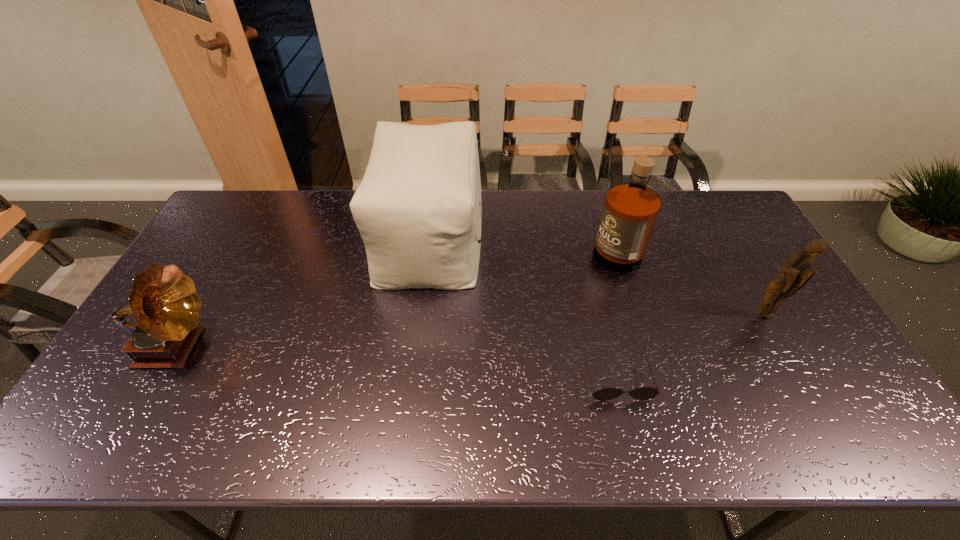
Image resolution: width=960 pixels, height=540 pixels. What are the coordinates of `unoccupied position between the figurine and the leftmost object` in the screenshot? It's located at (469, 331).

In order to click on vacant space in between the sunglasses and the fourth object from right to left in this screenshot , I will do `click(523, 309)`.

Choose which object is the nearest neighbor to the figurine. Please provide its 2D coordinates. Your answer should be formatted as a tuple, i.e. [(x, y)], where the tuple contains the x and y coordinates of a point satisfying the conditions above.

[(630, 211)]

Locate an element on the screen. The height and width of the screenshot is (540, 960). object that can be found as the third closest to the phonograph_record is located at coordinates (630, 211).

You are a GUI agent. You are given a task and a screenshot of the screen. Output one action in this format:
    pyautogui.click(x=<x>, y=<y>)
    Task: Click on the free space that satisfies the following two spatial constraints: 1. on the front label of the liquor; 2. on the front-facing side of the shortest object
    This screenshot has height=540, width=960.
    Given the screenshot: What is the action you would take?
    pyautogui.click(x=656, y=380)

Locate an element on the screen. Image resolution: width=960 pixels, height=540 pixels. vacant space that satisfies the following two spatial constraints: 1. on the front-facing side of the figurine; 2. on the horn of the leftmost object is located at coordinates (782, 348).